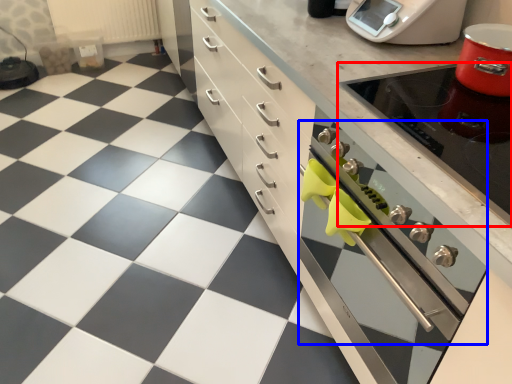
Question: Which object is closer to the camera taking this photo, appliance (highlighted by a red box) or oven (highlighted by a blue box)?

Choices:
 (A) appliance
 (B) oven

Answer: (B)